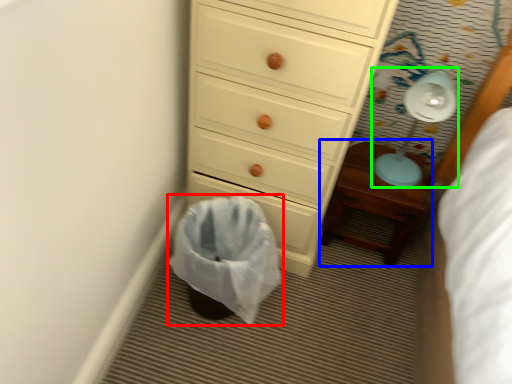
Question: Which object is the closest to the laundry basket (highlighted by a red box)? Choose among these: nightstand (highlighted by a blue box) or lamp (highlighted by a green box).

Choices:
 (A) nightstand
 (B) lamp

Answer: (A)